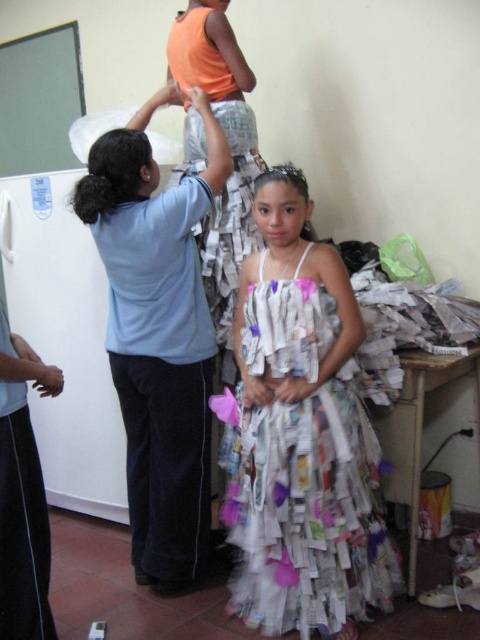
You are a photographer standing in the classroom and want to take a closeup shot of the recycled paper dress at center. The camera you are using has a minimum focusing distance of 1.5 meters. Can you take the photo without moving closer?

The recycled paper dress at center is 1.80 meters away from the viewer. Since the camera requires a minimum focusing distance of 1.5 meters, the photographer can take the closeup shot without moving closer because the dress is within the camera range.

You are organizing a fashion show and need to ensure that all outfits fit through a narrow doorway. The recycled paper dress at center and the matte blue shirt at upper left are the first two outfits to be transported. Given their sizes, which outfit will require more caution to avoid tearing when moving through the doorway?

The recycled paper dress at center is smaller than the matte blue shirt at upper left, so the matte blue shirt at upper left may require more caution to avoid tearing when moving through the doorway because it is larger and might be more prone to catching on edges.

You are a photographer setting up for a photoshoot in this classroom. You need to ensure that both the recycled paper dress at center and the matte blue shirt at upper left are visible in the frame. Based on their positions, which object should you focus on first to ensure both are in focus?

The recycled paper dress at center is closer to the viewer than the matte blue shirt at upper left. To ensure both are in focus, you should focus on the recycled paper dress at center first, as it is closer, and the matte blue shirt at upper left will naturally fall into focus behind it.